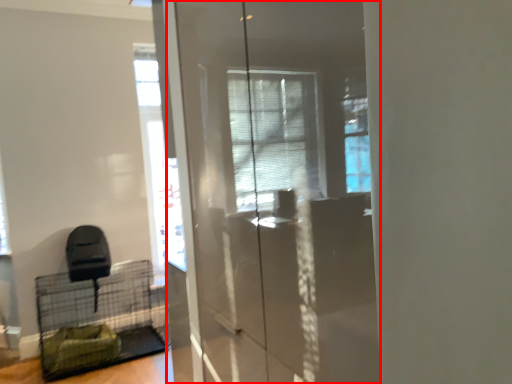
Question: Observing the image, what is the correct spatial positioning of screen door (annotated by the red box) in reference to bird cage?

Choices:
 (A) left
 (B) right

Answer: (B)